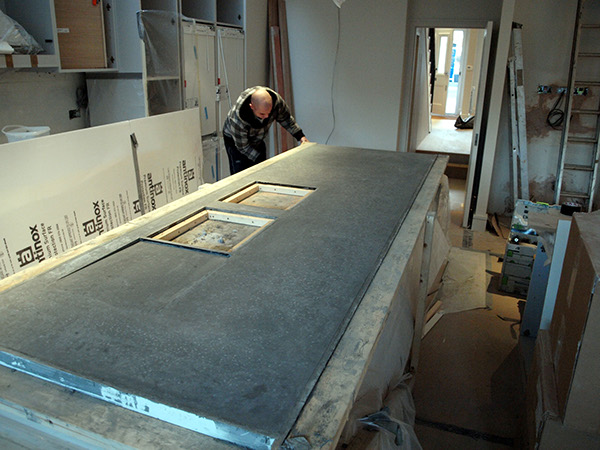
Where is `sheetrock`? The height and width of the screenshot is (450, 600). sheetrock is located at coordinates (72, 165).